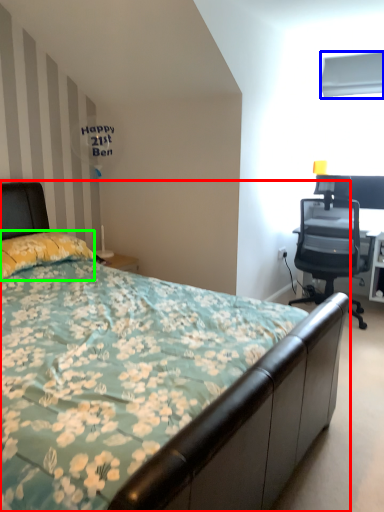
Question: Which object is positioned farthest from bed (highlighted by a red box)? Select from window screen (highlighted by a blue box) and pillow (highlighted by a green box).

Choices:
 (A) window screen
 (B) pillow

Answer: (A)